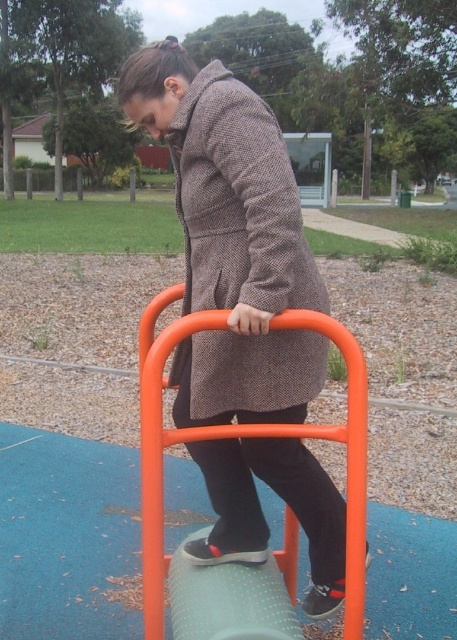
Who is shorter, matte brown coat at center or herringbone wool coat at center?

herringbone wool coat at center

Is matte brown coat at center shorter than herringbone wool coat at center?

No, matte brown coat at center is not shorter than herringbone wool coat at center.

Find the location of a particular element. The width and height of the screenshot is (457, 640). matte brown coat at center is located at coordinates (232, 241).